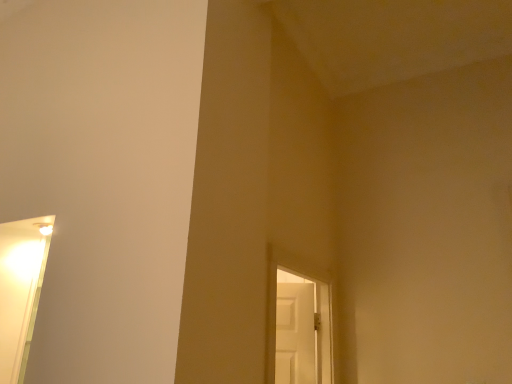
I want to click on white wooden door at center, so click(x=298, y=328).

What is the approximate height of white wooden door at center?

68.41 centimeters.

Describe the element at coordinates (298, 328) in the screenshot. I see `white wooden door at center` at that location.

In order to face white wooden door at center, should I rotate leftwards or rightwards?

To align with it, rotate right about 7.161°.

At what (x,y) coordinates should I click in order to perform the action: click on white wooden door at center. Please return your answer as a coordinate pair (x, y). Looking at the image, I should click on (298, 328).